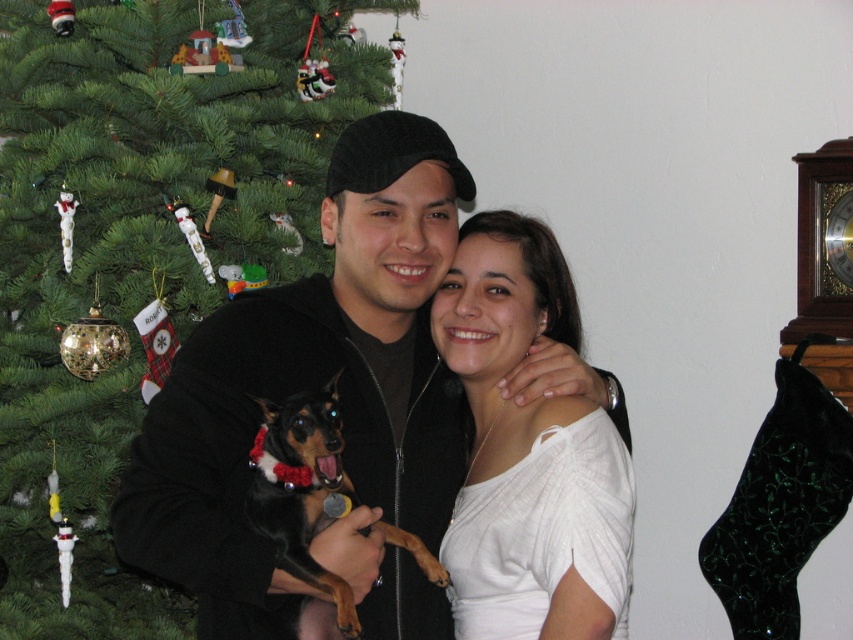
Question: Which of the following is the closest to the observer?

Choices:
 (A) green matte christmas tree at left
 (B) black fleece jacket at center

Answer: (B)

Question: Which of these objects is positioned farthest from the green matte christmas tree at left?

Choices:
 (A) black fleece jacket at center
 (B) white matte shirt at center
 (C) black shiny dog at center

Answer: (C)

Question: Is white matte shirt at center bigger than black shiny dog at center?

Choices:
 (A) no
 (B) yes

Answer: (B)

Question: Does green matte christmas tree at left lie behind white matte shirt at center?

Choices:
 (A) yes
 (B) no

Answer: (A)

Question: Is green matte christmas tree at left closer to camera compared to black fleece jacket at center?

Choices:
 (A) no
 (B) yes

Answer: (A)

Question: Considering the real-world distances, which object is closest to the black fleece jacket at center?

Choices:
 (A) black shiny dog at center
 (B) green matte christmas tree at left
 (C) white matte shirt at center

Answer: (A)